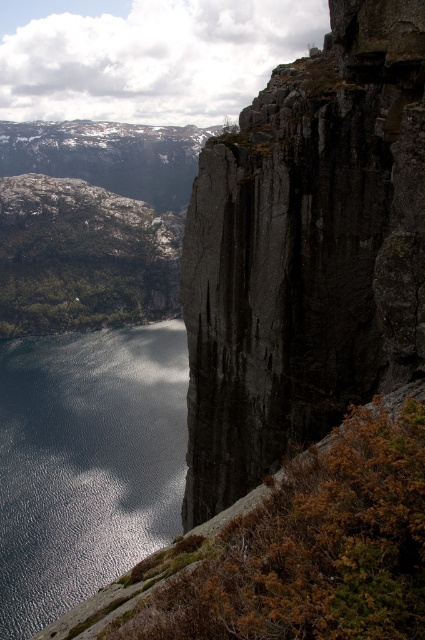
Question: Which point is farther to the camera?

Choices:
 (A) glistening reflective water at lower left
 (B) dark gray rock face at upper right

Answer: (A)

Question: Which of these objects is positioned farthest from the dark gray rock face at upper right?

Choices:
 (A) brown grassy hillside at lower left
 (B) glistening reflective water at lower left

Answer: (B)

Question: Which object is the closest to the glistening reflective water at lower left?

Choices:
 (A) brown grassy hillside at lower left
 (B) dark gray rock face at upper right

Answer: (A)

Question: Does glistening reflective water at lower left have a smaller size compared to brown grassy hillside at lower left?

Choices:
 (A) yes
 (B) no

Answer: (B)

Question: Is glistening reflective water at lower left bigger than brown grassy hillside at lower left?

Choices:
 (A) no
 (B) yes

Answer: (B)

Question: Is glistening reflective water at lower left to the left of brown grassy hillside at lower left from the viewer's perspective?

Choices:
 (A) no
 (B) yes

Answer: (B)